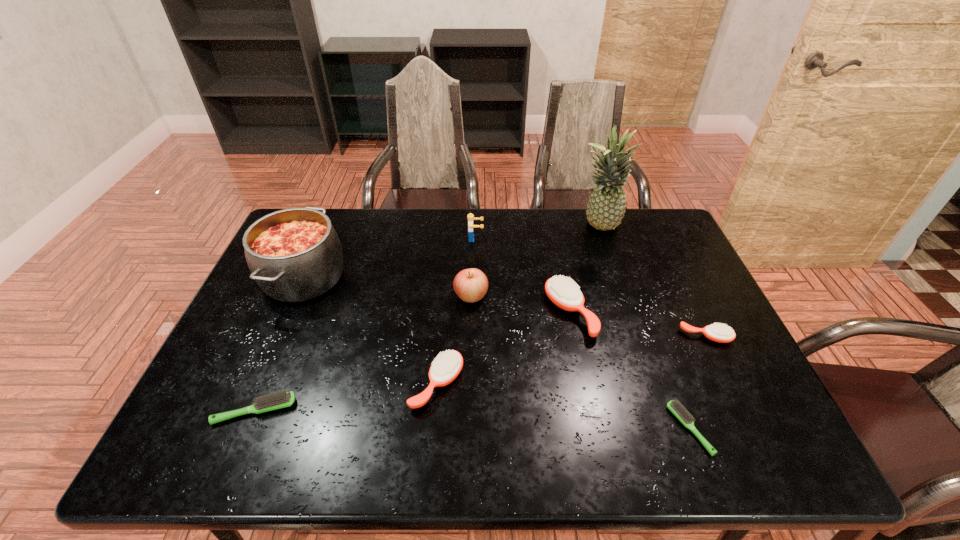
The width and height of the screenshot is (960, 540). What are the coordinates of `orange hairbrush that is the third closest to the red apple` in the screenshot? It's located at (717, 332).

Identify which orange hairbrush is the second closest to the fifth tallest object. Please provide its 2D coordinates. Your answer should be formatted as a tuple, i.e. [(x, y)], where the tuple contains the x and y coordinates of a point satisfying the conditions above.

[(446, 367)]

You are a GUI agent. You are given a task and a screenshot of the screen. Output one action in this format:
    pyautogui.click(x=<x>, y=<y>)
    Task: Click on the vacant space that satisfies the following two spatial constraints: 1. on the face of the second orange hairbrush from left to right; 2. on the left side of the Lego
    The image size is (960, 540).
    Given the screenshot: What is the action you would take?
    pyautogui.click(x=474, y=313)

This screenshot has width=960, height=540. I want to click on vacant space that satisfies the following two spatial constraints: 1. on the front side of the apple; 2. on the left side of the second tallest object, so click(296, 296).

Locate an element on the screen. vacant point that satisfies the following two spatial constraints: 1. on the front side of the biggest orange hairbrush; 2. on the left side of the red apple is located at coordinates (470, 313).

The image size is (960, 540). I want to click on free space that satisfies the following two spatial constraints: 1. on the face of the sixth object from left to right; 2. on the right side of the Lego, so click(474, 313).